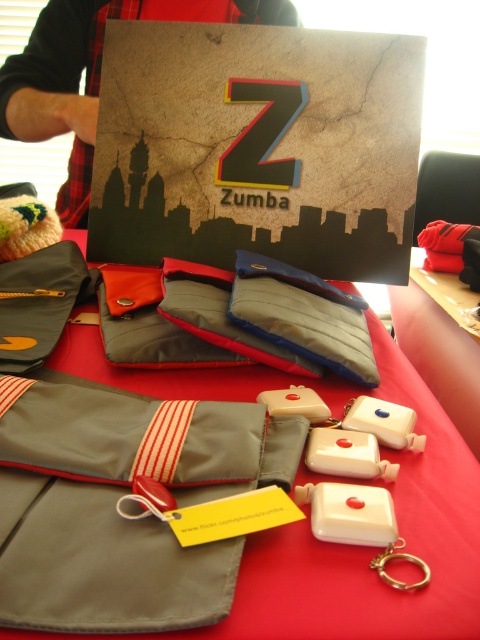
You are standing at the front of the display table and want to pick up an item. Which of the two points, point (57,564) or point (343,392), is closer to you?

Point (57,564) is closer to the viewer than point (343,392), so you should reach for that one first.

You are organizing a Zumba event and need to place the gray fabric pouch at center and the red fabric tablecloth at center on a shelf. Which item requires more shelf space?

The red fabric tablecloth at center requires more shelf space because the gray fabric pouch at center occupies less space than it.

You are organizing a Zumba event and need to place the gray fabric pouch at center and the red fabric tablecloth at center on a shelf. Which item should you place first if you want to stack them vertically?

The gray fabric pouch at center should be placed first since it is shorter than the red fabric tablecloth at center, allowing the taller tablecloth to be stacked on top without overhanging.